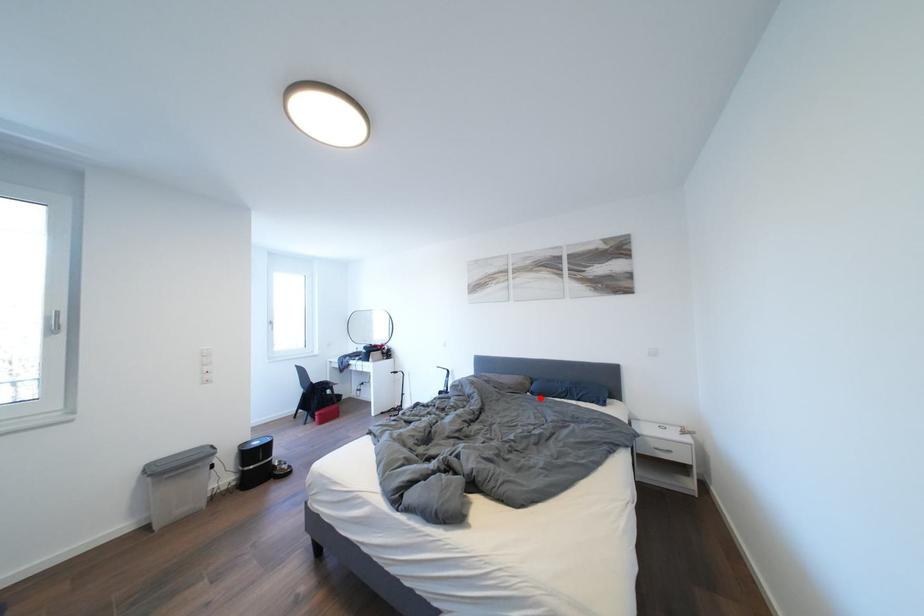
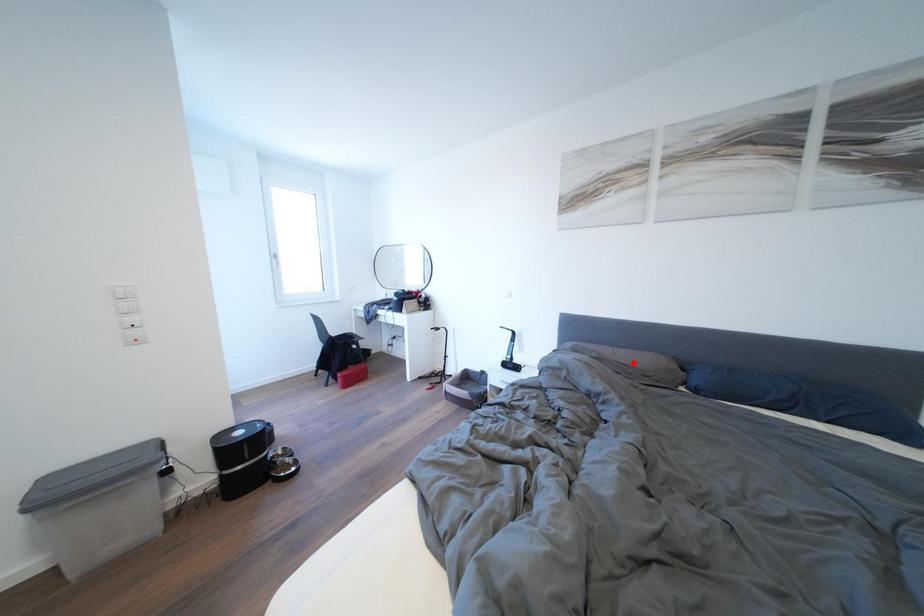
I am providing you with two images of the same scene from different viewpoints. A red point is marked on the first image and another point is marked on the second image. Are the points marked in image1 and image2 representing the same 3D position?

No